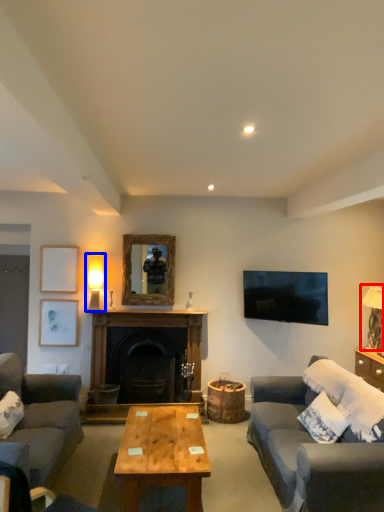
Question: Among these objects, which one is farthest to the camera, table lamp (highlighted by a red box) or table lamp (highlighted by a blue box)?

Choices:
 (A) table lamp
 (B) table lamp

Answer: (B)